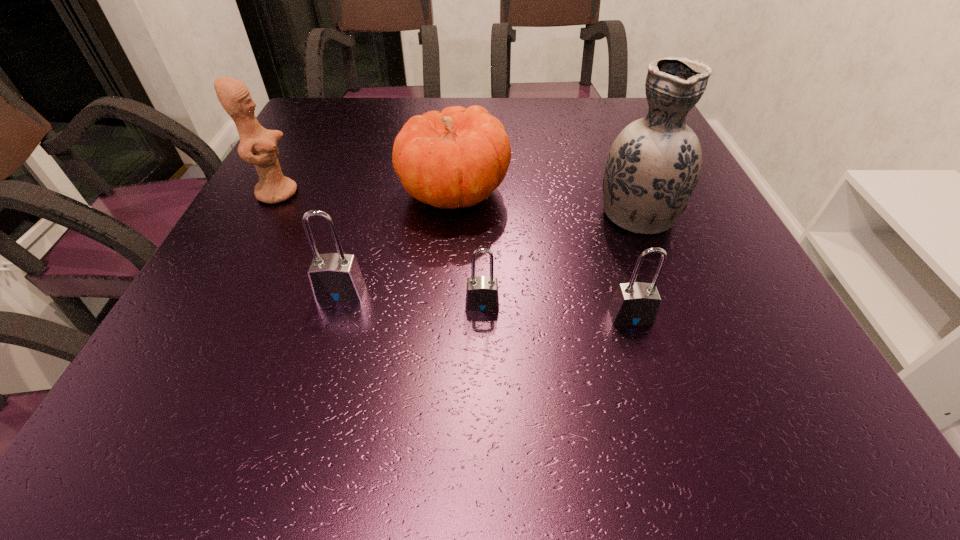
What are the coordinates of `free point between the pumpkin and the second object from left to right` in the screenshot? It's located at (397, 241).

Locate an element on the screen. The image size is (960, 540). free space that is in between the pumpkin and the second object from left to right is located at coordinates (397, 241).

Identify the location of empty space between the vase and the second tallest padlock. This screenshot has width=960, height=540. (634, 264).

At what (x,y) coordinates should I click in order to perform the action: click on empty location between the tallest object and the pumpkin. Please return your answer as a coordinate pair (x, y). This screenshot has width=960, height=540. Looking at the image, I should click on (545, 201).

Point out which object is positioned as the second nearest to the second shortest padlock. Please provide its 2D coordinates. Your answer should be formatted as a tuple, i.e. [(x, y)], where the tuple contains the x and y coordinates of a point satisfying the conditions above.

[(482, 295)]

What are the coordinates of `object that ranks as the fourth closest to the vase` in the screenshot? It's located at point(334,277).

Point out which padlock is positioned as the second nearest to the shortest padlock. Please provide its 2D coordinates. Your answer should be formatted as a tuple, i.e. [(x, y)], where the tuple contains the x and y coordinates of a point satisfying the conditions above.

[(636, 303)]

Locate an element on the screen. padlock that is the closest to the pumpkin is located at coordinates (334, 277).

The height and width of the screenshot is (540, 960). Find the location of `vacant region that satisfies the following two spatial constraints: 1. with the handle on the side of the tallest object; 2. on the front-facing side of the figurine`. vacant region that satisfies the following two spatial constraints: 1. with the handle on the side of the tallest object; 2. on the front-facing side of the figurine is located at coordinates (629, 193).